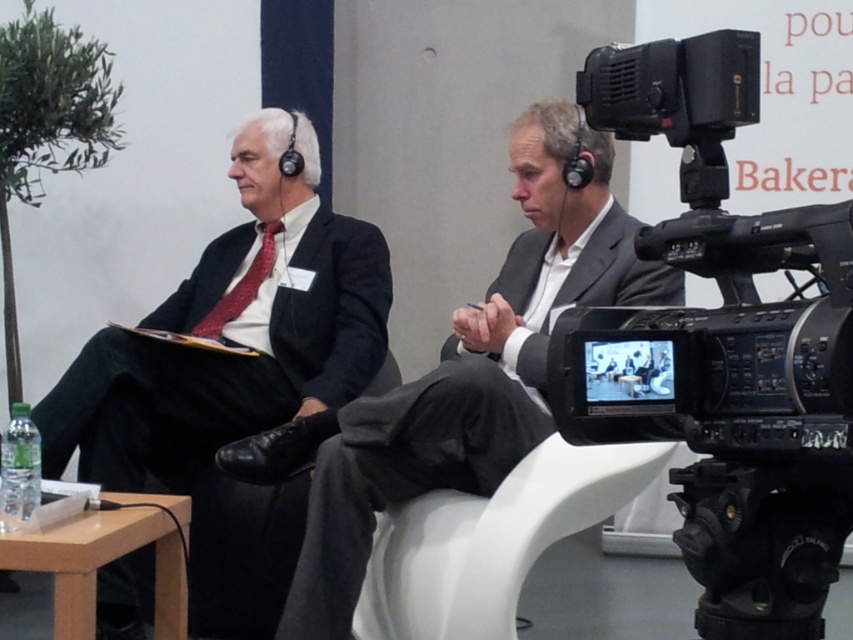
Question: Is dark gray suit at center closer to camera compared to matte black suit at left?

Choices:
 (A) no
 (B) yes

Answer: (B)

Question: Considering the relative positions of black plastic video camera at right and matte black suit at left in the image provided, where is black plastic video camera at right located with respect to matte black suit at left?

Choices:
 (A) right
 (B) left

Answer: (A)

Question: Is black plastic video camera at right smaller than dark gray suit at center?

Choices:
 (A) no
 (B) yes

Answer: (B)

Question: Which object appears farthest from the camera in this image?

Choices:
 (A) matte red tie at left
 (B) dark gray suit at center
 (C) black plastic video camera at right
 (D) matte black suit at left

Answer: (A)

Question: Estimate the real-world distances between objects in this image. Which object is closer to the matte black suit at left?

Choices:
 (A) dark gray suit at center
 (B) black plastic video camera at right
 (C) matte red tie at left

Answer: (C)

Question: Estimate the real-world distances between objects in this image. Which object is closer to the matte black suit at left?

Choices:
 (A) matte red tie at left
 (B) black plastic video camera at right

Answer: (A)